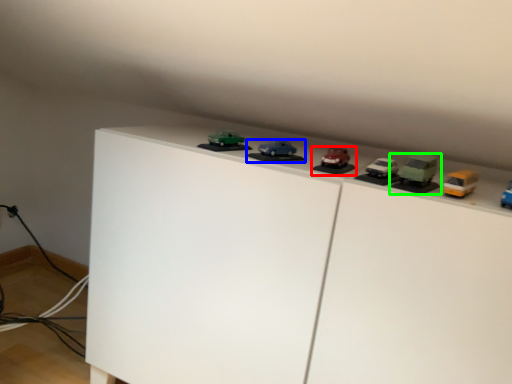
Question: Based on their relative distances, which object is nearer to toy (highlighted by a red box)? Choose from toy (highlighted by a blue box) and toy (highlighted by a green box).

Choices:
 (A) toy
 (B) toy

Answer: (A)